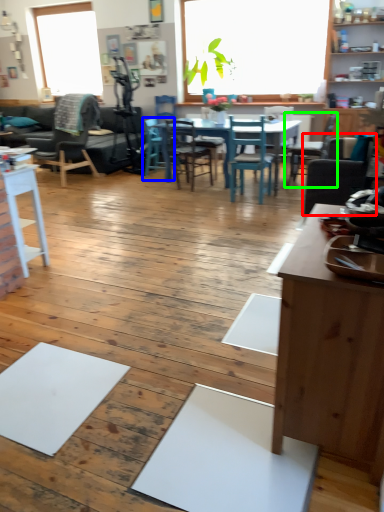
Question: Which object is positioned farthest from chair (highlighted by a red box)? Select from chair (highlighted by a blue box) and chair (highlighted by a green box).

Choices:
 (A) chair
 (B) chair

Answer: (A)